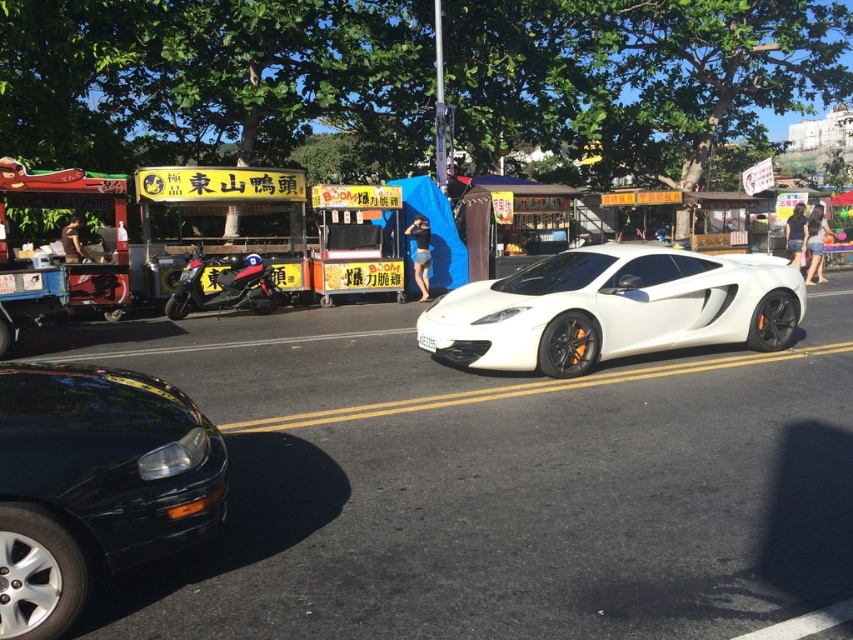
Question: Is shiny black motorcycle at left positioned at the back of white plastic license plate at center?

Choices:
 (A) yes
 (B) no

Answer: (A)

Question: Which is nearer to the glossy black sedan at lower left?

Choices:
 (A) white plastic license plate at center
 (B) shiny black motorcycle at left

Answer: (A)

Question: Among these objects, which one is farthest from the camera?

Choices:
 (A) white glossy sports car at center
 (B) white plastic license plate at center
 (C) shiny black motorcycle at left
 (D) glossy black sedan at lower left

Answer: (C)

Question: Which of the following is the farthest from the observer?

Choices:
 (A) shiny black motorcycle at left
 (B) white glossy sports car at center

Answer: (A)

Question: Can you confirm if white glossy sports car at center is positioned below white plastic license plate at center?

Choices:
 (A) no
 (B) yes

Answer: (A)

Question: Is shiny black motorcycle at left bigger than white plastic license plate at center?

Choices:
 (A) no
 (B) yes

Answer: (B)